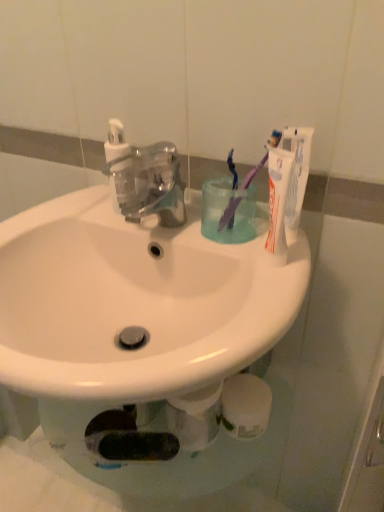
Describe the element at coordinates (296, 176) in the screenshot. I see `white matte toothpaste at upper right` at that location.

Where is `purple plastic toothbrush at upper right, the 1th toothbrush in the right-to-left sequence`? purple plastic toothbrush at upper right, the 1th toothbrush in the right-to-left sequence is located at coordinates (239, 195).

What do you see at coordinates (239, 195) in the screenshot?
I see `purple plastic toothbrush at upper right, the 1th toothbrush in the right-to-left sequence` at bounding box center [239, 195].

This screenshot has height=512, width=384. In order to click on purple plastic toothbrush at upper right, which is the second toothbrush in right-to-left order in this screenshot , I will do `click(229, 214)`.

Which is correct: white matte toothpaste at upper right is inside transparent plastic faucet at center, or outside of it?

white matte toothpaste at upper right is located beyond the bounds of transparent plastic faucet at center.

Based on the photo, is transparent plastic faucet at center at the back of white matte toothpaste at upper right?

white matte toothpaste at upper right is not turned away from transparent plastic faucet at center.

Does white matte toothpaste at upper right have a larger size compared to transparent plastic faucet at center?

No, white matte toothpaste at upper right is not bigger than transparent plastic faucet at center.

From a real-world perspective, is white matte toothpaste at upper right over transparent plastic faucet at center?

Yes, from a real-world perspective, white matte toothpaste at upper right is on top of transparent plastic faucet at center.

Is transparent plastic soap dispenser at upper left facing towards white glossy sink at center?

A: No, transparent plastic soap dispenser at upper left is not aimed at white glossy sink at center.

From the image's perspective, which one is positioned lower, transparent plastic soap dispenser at upper left or white glossy sink at center?

white glossy sink at center appears lower in the image.

Measure the distance from transparent plastic soap dispenser at upper left to white glossy sink at center.

transparent plastic soap dispenser at upper left and white glossy sink at center are 7.95 inches apart.

Which object is positioned more to the left, transparent plastic soap dispenser at upper left or white glossy sink at center?

transparent plastic soap dispenser at upper left is more to the left.

Is transparent plastic faucet at center not within white glossy sink at center?

Indeed, transparent plastic faucet at center is completely outside white glossy sink at center.

Which object is positioned more to the left, transparent plastic faucet at center or white glossy sink at center?

Positioned to the left is white glossy sink at center.

Is transparent plastic faucet at center aimed at white glossy sink at center?

No, transparent plastic faucet at center is not facing towards white glossy sink at center.

Which is more to the right, transparent plastic faucet at center or purple plastic toothbrush at upper right, the 1th toothbrush in the right-to-left sequence?

From the viewer's perspective, purple plastic toothbrush at upper right, the 1th toothbrush in the right-to-left sequence, appears more on the right side.

Based on the photo, between transparent plastic faucet at center and purple plastic toothbrush at upper right, which is the 2th toothbrush from left to right, which one has larger size?

Bigger between the two is transparent plastic faucet at center.

Starting from the transparent plastic faucet at center, which toothbrush is the 1st one behind? Please provide its 2D coordinates.

[(239, 195)]

Is translucent plastic cup at center smaller than transparent plastic soap dispenser at upper left?

Actually, translucent plastic cup at center might be larger than transparent plastic soap dispenser at upper left.

Is translucent plastic cup at center further to the viewer compared to transparent plastic soap dispenser at upper left?

No, the depth of translucent plastic cup at center is less than that of transparent plastic soap dispenser at upper left.

Between translucent plastic cup at center and transparent plastic soap dispenser at upper left, which one has more height?

transparent plastic soap dispenser at upper left.

From a real-world perspective, is translucent plastic cup at center below transparent plastic soap dispenser at upper left?

Yes, from a real-world perspective, translucent plastic cup at center is below transparent plastic soap dispenser at upper left.

Considering the sizes of white glossy sink at center and purple plastic toothbrush at upper right, which is the second toothbrush in right-to-left order, in the image, is white glossy sink at center taller or shorter than purple plastic toothbrush at upper right, which is the second toothbrush in right-to-left order,?

Clearly, white glossy sink at center is taller compared to purple plastic toothbrush at upper right, which is the second toothbrush in right-to-left order.

Considering the positions of objects white glossy sink at center and purple plastic toothbrush at upper right, which is the second toothbrush in right-to-left order, in the image provided, who is behind, white glossy sink at center or purple plastic toothbrush at upper right, which is the second toothbrush in right-to-left order,?

purple plastic toothbrush at upper right, which is the second toothbrush in right-to-left order, is more distant.

Is there a large distance between white glossy sink at center and purple plastic toothbrush at upper right, the 1th toothbrush when ordered from left to right?

Actually, white glossy sink at center and purple plastic toothbrush at upper right, the 1th toothbrush when ordered from left to right, are a little close together.

Is translucent plastic cup at center oriented towards white glossy sink at center?

No.

Is translucent plastic cup at center directly adjacent to white glossy sink at center?

No, translucent plastic cup at center is not with white glossy sink at center.

From a real-world perspective, which is physically below, translucent plastic cup at center or white glossy sink at center?

white glossy sink at center.

Locate an element on the screen. tap below the white matte toothpaste at upper right (from the image's perspective) is located at coordinates (149, 184).

Where is `sink on the right of transparent plastic soap dispenser at upper left`? This screenshot has height=512, width=384. sink on the right of transparent plastic soap dispenser at upper left is located at coordinates (135, 300).

Looking at the image, which one is located closer to purple plastic toothbrush at upper right, the 1th toothbrush when ordered from left to right, translucent plastic cup at center or white matte toothpaste at upper right?

translucent plastic cup at center.

Estimate the real-world distances between objects in this image. Which object is closer to white glossy sink at center, white matte toothpaste at upper right or translucent plastic cup at center?

translucent plastic cup at center is closer to white glossy sink at center.

Looking at the image, which one is located closer to white matte toothpaste at upper right, transparent plastic soap dispenser at upper left or purple plastic toothbrush at upper right, which is the second toothbrush in right-to-left order?

Based on the image, purple plastic toothbrush at upper right, which is the second toothbrush in right-to-left order, appears to be nearer to white matte toothpaste at upper right.

Based on their spatial positions, is white matte toothpaste at upper right or purple plastic toothbrush at upper right, the 1th toothbrush when ordered from left to right, closer to white glossy sink at center?

purple plastic toothbrush at upper right, the 1th toothbrush when ordered from left to right, lies closer to white glossy sink at center than the other object.

When comparing their distances from white matte toothpaste at upper right, does transparent plastic soap dispenser at upper left or transparent plastic faucet at center seem closer?

transparent plastic faucet at center.

When comparing their distances from white matte toothpaste at upper right, does white glossy sink at center or transparent plastic faucet at center seem further?

white glossy sink at center lies further to white matte toothpaste at upper right than the other object.

Considering their positions, is transparent plastic soap dispenser at upper left positioned further to white matte toothpaste at upper right than purple plastic toothbrush at upper right, which is the 2th toothbrush from left to right?

Among the two, transparent plastic soap dispenser at upper left is located further to white matte toothpaste at upper right.

From the image, which object appears to be farther from translucent plastic cup at center, transparent plastic soap dispenser at upper left or transparent plastic faucet at center?

Among the two, transparent plastic soap dispenser at upper left is located further to translucent plastic cup at center.

The image size is (384, 512). Identify the location of liquid located between transparent plastic soap dispenser at upper left and purple plastic toothbrush at upper right, the 1th toothbrush when ordered from left to right, in the left-right direction. point(224,210).

Locate an element on the screen. tap between white glossy sink at center and purple plastic toothbrush at upper right, the 1th toothbrush when ordered from left to right, from front to back is located at coordinates (149, 184).

Locate an element on the screen. The height and width of the screenshot is (512, 384). liquid situated between transparent plastic soap dispenser at upper left and purple plastic toothbrush at upper right, the 1th toothbrush in the right-to-left sequence, from left to right is located at coordinates (224, 210).

At what (x,y) coordinates should I click in order to perform the action: click on tap situated between transparent plastic soap dispenser at upper left and purple plastic toothbrush at upper right, which is the second toothbrush in right-to-left order, from left to right. Please return your answer as a coordinate pair (x, y). Looking at the image, I should click on tap(149, 184).